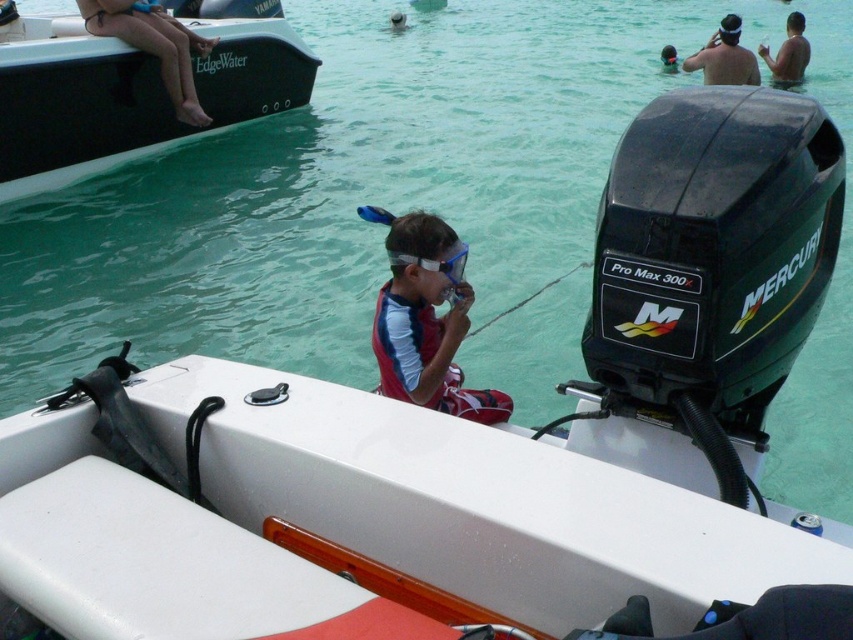
Question: Is red matte life jacket at center to the left of tan skin legs at upper left from the viewer's perspective?

Choices:
 (A) no
 (B) yes

Answer: (A)

Question: Which point appears closest to the camera in this image?

Choices:
 (A) (460, 275)
 (B) (721, 51)
 (C) (781, 60)
 (D) (99, 35)

Answer: (A)

Question: Can you confirm if smooth skin headband at upper right is positioned above clear plastic goggles at center?

Choices:
 (A) yes
 (B) no

Answer: (A)

Question: Which object is the farthest from the tan skin legs at upper left?

Choices:
 (A) smooth skin headband at upper right
 (B) red matte snorkel gear at center
 (C) red matte life jacket at center

Answer: (A)

Question: Observing the image, what is the correct spatial positioning of red matte snorkel gear at center in reference to tan skin legs at upper left?

Choices:
 (A) above
 (B) below

Answer: (B)

Question: Which of the following is the farthest from the observer?

Choices:
 (A) (753, 76)
 (B) (49, 81)

Answer: (A)